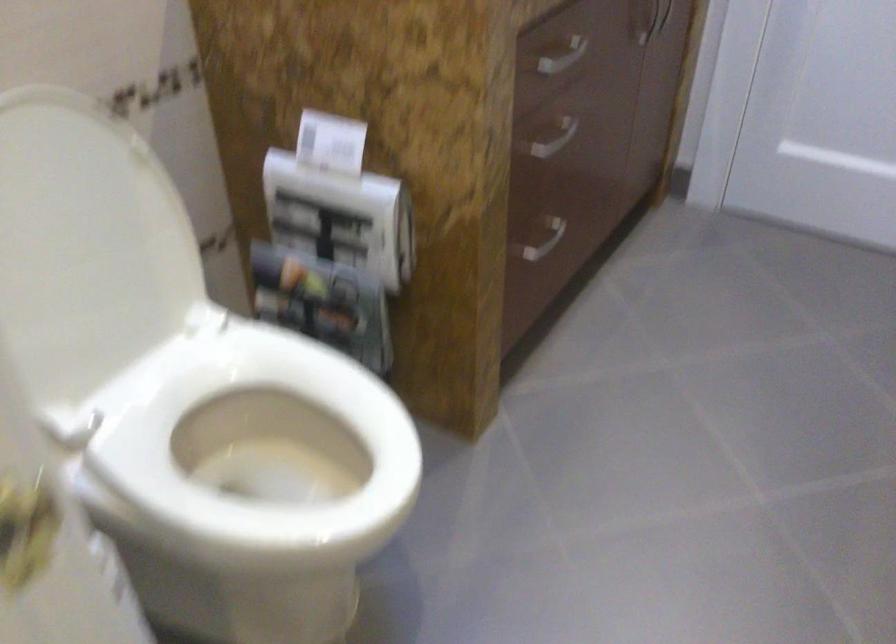
At what (x,y) coordinates should I click in order to perform the action: click on white toilet lid. Please return your answer as a coordinate pair (x, y). Looking at the image, I should click on pyautogui.click(x=170, y=164).